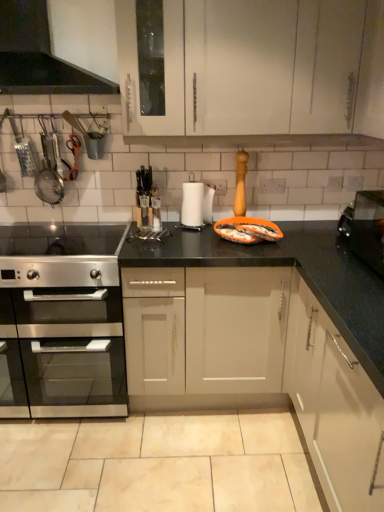
Question: Is stainless steel oven at left spatially inside beige matte granite at lower center, or outside of it?

Choices:
 (A) inside
 (B) outside

Answer: (B)

Question: Considering the relative positions of stainless steel oven at left and beige matte granite at lower center in the image provided, is stainless steel oven at left to the left or to the right of beige matte granite at lower center?

Choices:
 (A) left
 (B) right

Answer: (A)

Question: Estimate the real-world distances between objects in this image. Which object is closer to the metallic strainer at left, the 1th appliance from the top?

Choices:
 (A) white paper towel at center
 (B) beige matte granite at lower center
 (C) black matte range hood at upper left
 (D) satin silver gas stove at lower left
 (E) stainless steel oven at left

Answer: (D)

Question: Based on their relative distances, which object is farther from the metallic strainer at left, the 1th appliance from the top?

Choices:
 (A) black matte range hood at upper left
 (B) black stainless steel toaster at right, arranged as the 1th appliance when viewed from the front
 (C) matte white cabinet at center
 (D) stainless steel oven at left
 (E) satin silver gas stove at lower left

Answer: (B)